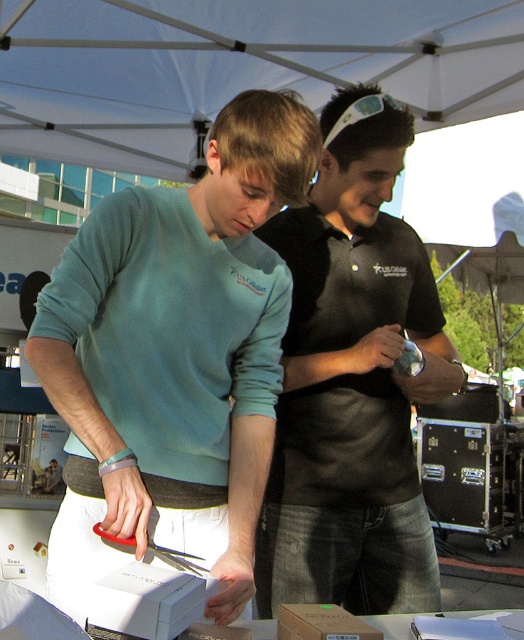
Question: Is black matte shirt at center smaller than brown cardboard box at lower center?

Choices:
 (A) yes
 (B) no

Answer: (B)

Question: Is matte blue sweater at center thinner than black matte shirt at center?

Choices:
 (A) yes
 (B) no

Answer: (B)

Question: Which of the following is the farthest from the observer?

Choices:
 (A) matte blue sweater at center
 (B) white matte box at center

Answer: (A)

Question: Which object is the closest to the black matte shirt at center?

Choices:
 (A) brown cardboard box at lower center
 (B) white matte box at center
 (C) matte blue sweater at center

Answer: (C)

Question: Which object is positioned closest to the black matte shirt at center?

Choices:
 (A) white matte box at center
 (B) brown cardboard box at lower center

Answer: (B)

Question: Can you confirm if matte blue sweater at center is positioned to the left of white matte box at center?

Choices:
 (A) no
 (B) yes

Answer: (B)